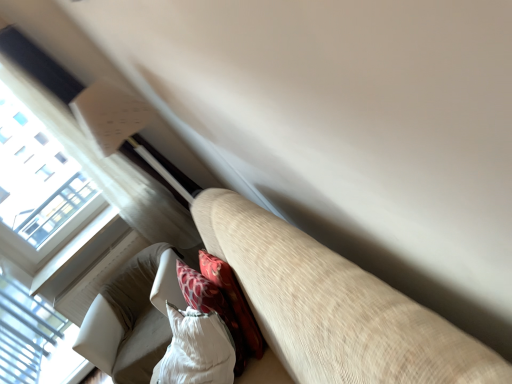
This screenshot has width=512, height=384. What do you see at coordinates (133, 317) in the screenshot?
I see `white textured bean bag chair at lower left, which ranks as the first bean bag chair in back-to-front order` at bounding box center [133, 317].

Where is `white textured bean bag chair at lower center, acting as the 2th bean bag chair starting from the back`? This screenshot has width=512, height=384. white textured bean bag chair at lower center, acting as the 2th bean bag chair starting from the back is located at coordinates (190, 334).

The height and width of the screenshot is (384, 512). What are the coordinates of `white textured bean bag chair at lower left, which ranks as the first bean bag chair in back-to-front order` in the screenshot? It's located at (133, 317).

How different are the orientations of white textured bean bag chair at lower left, arranged as the 2th bean bag chair when viewed from the front, and beige fabric couch at lower left in degrees?

62.3 degrees separate the facing orientations of white textured bean bag chair at lower left, arranged as the 2th bean bag chair when viewed from the front, and beige fabric couch at lower left.

Looking at this image, which object is more forward, white textured bean bag chair at lower left, which ranks as the first bean bag chair in back-to-front order, or beige fabric couch at lower left?

beige fabric couch at lower left is more forward.

Is white textured bean bag chair at lower left, arranged as the 2th bean bag chair when viewed from the front, taller or shorter than beige fabric couch at lower left?

white textured bean bag chair at lower left, arranged as the 2th bean bag chair when viewed from the front, is shorter than beige fabric couch at lower left.

Which is correct: white textured bean bag chair at lower left, which ranks as the first bean bag chair in back-to-front order, is inside beige fabric couch at lower left, or outside of it?

white textured bean bag chair at lower left, which ranks as the first bean bag chair in back-to-front order, is outside beige fabric couch at lower left.

From the white plastic window at lower left, count 1st bean bag chair to the right and point to it. Please provide its 2D coordinates.

[(133, 317)]

From the image's perspective, is white plastic window at lower left above or below white textured bean bag chair at lower left, which ranks as the first bean bag chair in back-to-front order?

white plastic window at lower left is situated lower than white textured bean bag chair at lower left, which ranks as the first bean bag chair in back-to-front order, in the image.

Which is correct: white plastic window at lower left is inside white textured bean bag chair at lower left, which ranks as the first bean bag chair in back-to-front order, or outside of it?

white plastic window at lower left exists outside the volume of white textured bean bag chair at lower left, which ranks as the first bean bag chair in back-to-front order.

Could you measure the distance between white plastic window at lower left and white textured bean bag chair at lower left, which ranks as the first bean bag chair in back-to-front order?

25.89 inches.

From a real-world perspective, is white textured bean bag chair at lower center, positioned as the first bean bag chair in front-to-back order, located higher than beige fabric couch at lower left?

Yes.

Does point (178, 350) appear closer or farther from the camera than point (358, 272)?

Point (178, 350).

Is white textured bean bag chair at lower center, positioned as the first bean bag chair in front-to-back order, looking in the opposite direction of beige fabric couch at lower left?

Yes, white textured bean bag chair at lower center, positioned as the first bean bag chair in front-to-back order, is positioned with its back facing beige fabric couch at lower left.

Is white textured bean bag chair at lower center, acting as the 2th bean bag chair starting from the back, thinner than beige fabric couch at lower left?

Yes, white textured bean bag chair at lower center, acting as the 2th bean bag chair starting from the back, is thinner than beige fabric couch at lower left.

In the image, is white plastic window at lower left on the left side or the right side of beige fabric couch at lower left?

Clearly, white plastic window at lower left is on the left of beige fabric couch at lower left in the image.

Which is behind, point (27, 374) or point (264, 245)?

The point (27, 374) is farther.

Which of these two, white plastic window at lower left or beige fabric couch at lower left, is wider?

Wider between the two is beige fabric couch at lower left.

Could you tell me if white plastic window at lower left is turned towards beige fabric couch at lower left?

No, white plastic window at lower left is not oriented towards beige fabric couch at lower left.

Does white textured bean bag chair at lower left, arranged as the 2th bean bag chair when viewed from the front, have a smaller size compared to white textured bean bag chair at lower center, positioned as the first bean bag chair in front-to-back order?

Incorrect, white textured bean bag chair at lower left, arranged as the 2th bean bag chair when viewed from the front, is not smaller in size than white textured bean bag chair at lower center, positioned as the first bean bag chair in front-to-back order.

Does white textured bean bag chair at lower left, arranged as the 2th bean bag chair when viewed from the front, have a lesser width compared to white textured bean bag chair at lower center, acting as the 2th bean bag chair starting from the back?

No, white textured bean bag chair at lower left, arranged as the 2th bean bag chair when viewed from the front, is not thinner than white textured bean bag chair at lower center, acting as the 2th bean bag chair starting from the back.

Looking at this image, from a real-world perspective, which object rests below the other?

white textured bean bag chair at lower left, arranged as the 2th bean bag chair when viewed from the front.

Is white textured bean bag chair at lower left, which ranks as the first bean bag chair in back-to-front order, inside the boundaries of white plastic window at lower left, or outside?

white textured bean bag chair at lower left, which ranks as the first bean bag chair in back-to-front order, is located beyond the bounds of white plastic window at lower left.

Considering the sizes of white textured bean bag chair at lower left, arranged as the 2th bean bag chair when viewed from the front, and white plastic window at lower left in the image, is white textured bean bag chair at lower left, arranged as the 2th bean bag chair when viewed from the front, wider or thinner than white plastic window at lower left?

Considering their sizes, white textured bean bag chair at lower left, arranged as the 2th bean bag chair when viewed from the front, looks broader than white plastic window at lower left.

Are white textured bean bag chair at lower left, arranged as the 2th bean bag chair when viewed from the front, and white plastic window at lower left making contact?

There is a gap between white textured bean bag chair at lower left, arranged as the 2th bean bag chair when viewed from the front, and white plastic window at lower left.

Considering the sizes of white plastic window at lower left and white textured bean bag chair at lower center, acting as the 2th bean bag chair starting from the back, in the image, is white plastic window at lower left taller or shorter than white textured bean bag chair at lower center, acting as the 2th bean bag chair starting from the back,?

In the image, white plastic window at lower left appears to be taller than white textured bean bag chair at lower center, acting as the 2th bean bag chair starting from the back.

Is point (60, 349) closer or farther from the camera than point (233, 345)?

Point (60, 349) is farther from the camera than point (233, 345).

Image resolution: width=512 pixels, height=384 pixels. What are the coordinates of `the 2nd bean bag chair in front of the white plastic window at lower left, starting your count from the anchor` in the screenshot? It's located at (190, 334).

Find the location of a particular element. This screenshot has width=512, height=384. bean bag chair below the beige fabric couch at lower left (from the image's perspective) is located at coordinates (133, 317).

This screenshot has height=384, width=512. Identify the location of the 1st bean bag chair to the right of the white plastic window at lower left, starting your count from the anchor. (133, 317).

Based on their spatial positions, is white textured bean bag chair at lower left, arranged as the 2th bean bag chair when viewed from the front, or white plastic window at lower left closer to white textured bean bag chair at lower center, positioned as the first bean bag chair in front-to-back order?

Based on the image, white textured bean bag chair at lower left, arranged as the 2th bean bag chair when viewed from the front, appears to be nearer to white textured bean bag chair at lower center, positioned as the first bean bag chair in front-to-back order.

Based on their spatial positions, is white textured bean bag chair at lower center, acting as the 2th bean bag chair starting from the back, or white plastic window at lower left further from beige fabric couch at lower left?

white plastic window at lower left is further to beige fabric couch at lower left.

From the image, which object appears to be farther from white textured bean bag chair at lower left, arranged as the 2th bean bag chair when viewed from the front, white plastic window at lower left or white textured bean bag chair at lower center, acting as the 2th bean bag chair starting from the back?

Based on the image, white plastic window at lower left appears to be further to white textured bean bag chair at lower left, arranged as the 2th bean bag chair when viewed from the front.

Which object lies nearer to the anchor point beige fabric couch at lower left, white plastic window at lower left or white textured bean bag chair at lower left, which ranks as the first bean bag chair in back-to-front order?

white textured bean bag chair at lower left, which ranks as the first bean bag chair in back-to-front order, is closer to beige fabric couch at lower left.

Estimate the real-world distances between objects in this image. Which object is closer to beige fabric couch at lower left, white textured bean bag chair at lower left, which ranks as the first bean bag chair in back-to-front order, or white plastic window at lower left?

white textured bean bag chair at lower left, which ranks as the first bean bag chair in back-to-front order, is positioned closer to the anchor beige fabric couch at lower left.

Based on the photo, which object lies nearer to the anchor point white textured bean bag chair at lower center, acting as the 2th bean bag chair starting from the back, white plastic window at lower left or beige fabric couch at lower left?

beige fabric couch at lower left is closer to white textured bean bag chair at lower center, acting as the 2th bean bag chair starting from the back.

Estimate the real-world distances between objects in this image. Which object is further from white textured bean bag chair at lower left, which ranks as the first bean bag chair in back-to-front order, beige fabric couch at lower left or white textured bean bag chair at lower center, acting as the 2th bean bag chair starting from the back?

beige fabric couch at lower left is positioned further to the anchor white textured bean bag chair at lower left, which ranks as the first bean bag chair in back-to-front order.

Which object lies further to the anchor point white textured bean bag chair at lower center, acting as the 2th bean bag chair starting from the back, white textured bean bag chair at lower left, arranged as the 2th bean bag chair when viewed from the front, or beige fabric couch at lower left?

Result: beige fabric couch at lower left.

Where is `bean bag chair between white plastic window at lower left and white textured bean bag chair at lower center, positioned as the first bean bag chair in front-to-back order, from left to right`? The height and width of the screenshot is (384, 512). bean bag chair between white plastic window at lower left and white textured bean bag chair at lower center, positioned as the first bean bag chair in front-to-back order, from left to right is located at coordinates (133, 317).

The width and height of the screenshot is (512, 384). Find the location of `bean bag chair located between beige fabric couch at lower left and white textured bean bag chair at lower left, which ranks as the first bean bag chair in back-to-front order, in the depth direction`. bean bag chair located between beige fabric couch at lower left and white textured bean bag chair at lower left, which ranks as the first bean bag chair in back-to-front order, in the depth direction is located at coordinates (190, 334).